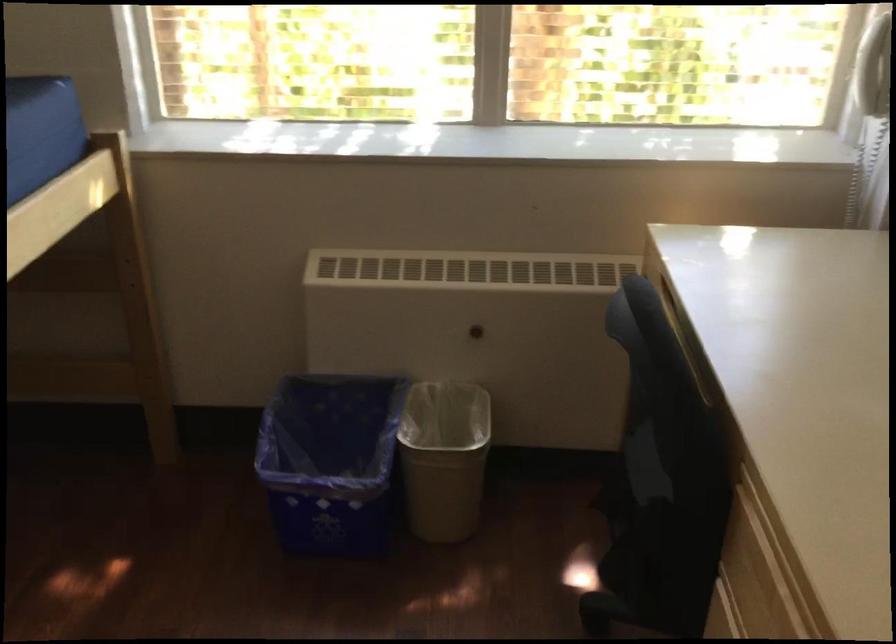
Describe the element at coordinates (476, 330) in the screenshot. The width and height of the screenshot is (896, 644). I see `the heater control dial` at that location.